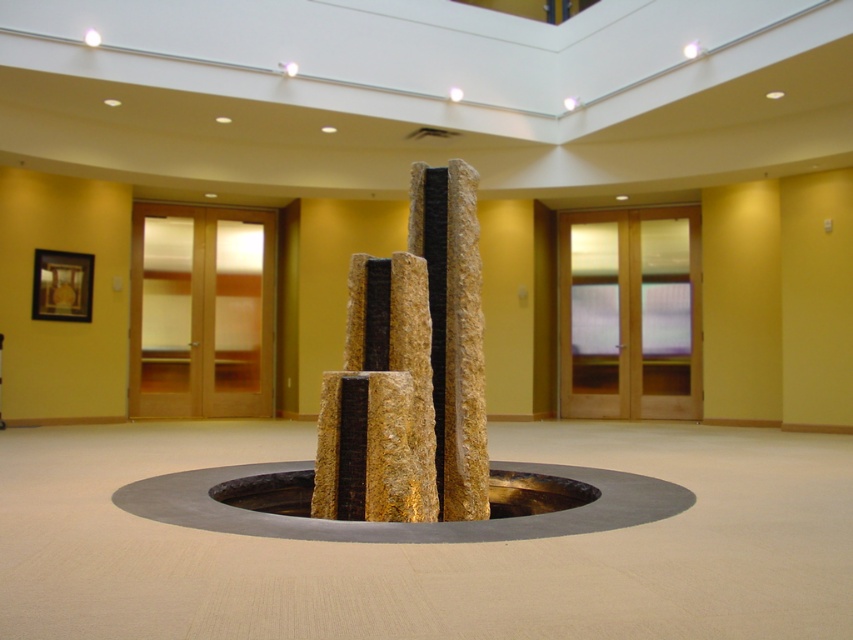
You are a delivery person carrying a package that requires a 1.5 meter clearance between the golden textured stone at center and the metallic circular manhole at center to pass through. Can you navigate through the space between them?

The golden textured stone at center and metallic circular manhole at center are 1.26 meters apart from each other. Since the required clearance is 1.5 meters, the distance is insufficient. You cannot navigate through the space between them.

You are an inspector checking the structural integrity of the golden textured stone at center and the metallic circular manhole at center. Which object is located directly above the other?

The golden textured stone at center is positioned over the metallic circular manhole at center, meaning it is directly above it.